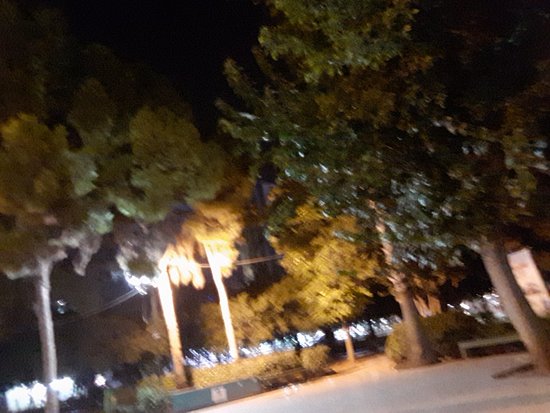
The height and width of the screenshot is (413, 550). In order to click on lights in this screenshot , I will do `click(16, 394)`, `click(34, 391)`, `click(66, 389)`, `click(104, 377)`, `click(204, 361)`, `click(318, 335)`, `click(337, 330)`, `click(378, 325)`, `click(478, 306)`.